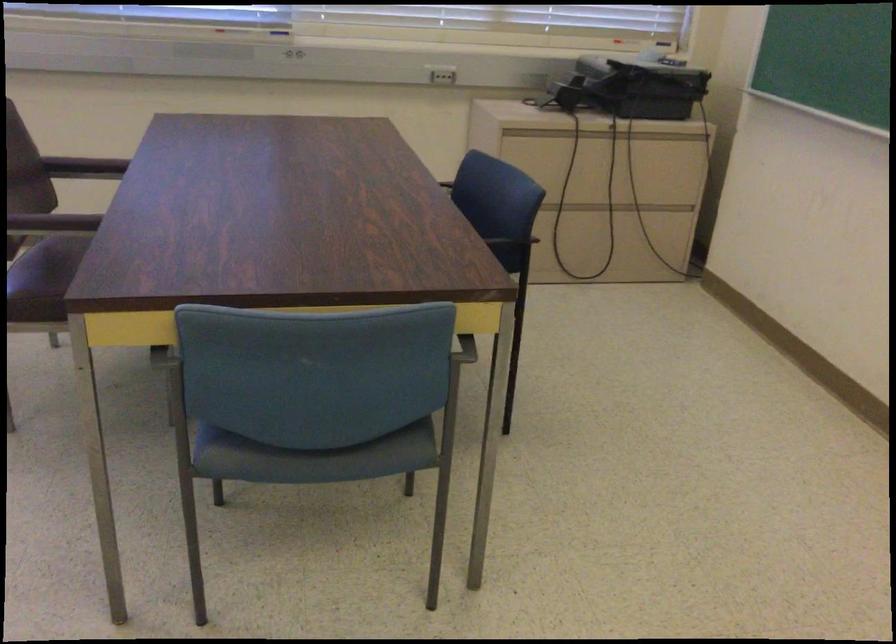
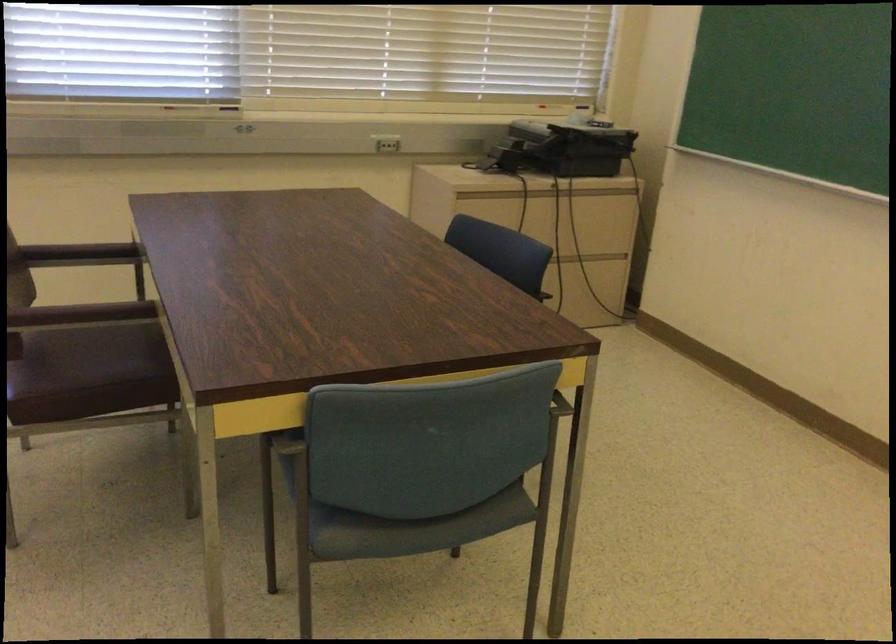
Question: How did the camera likely rotate?

Choices:
 (A) Left
 (B) Right
 (C) Up
 (D) Down

Answer: (B)